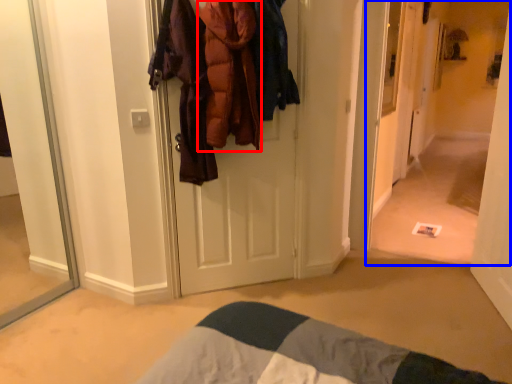
Question: Which object is further to the camera taking this photo, clothing (highlighted by a red box) or corridor (highlighted by a blue box)?

Choices:
 (A) clothing
 (B) corridor

Answer: (B)